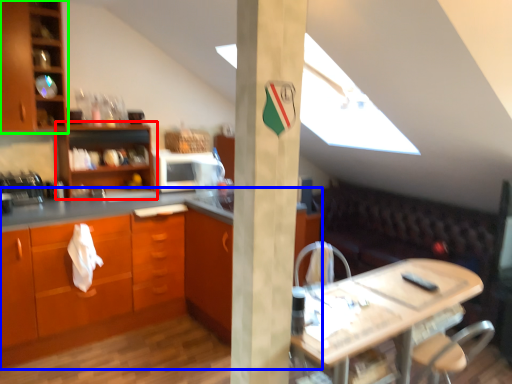
Question: Considering the real-world distances, which object is closest to shelf (highlighted by a red box)? countertop (highlighted by a blue box) or cabinetry (highlighted by a green box).

Choices:
 (A) countertop
 (B) cabinetry

Answer: (B)